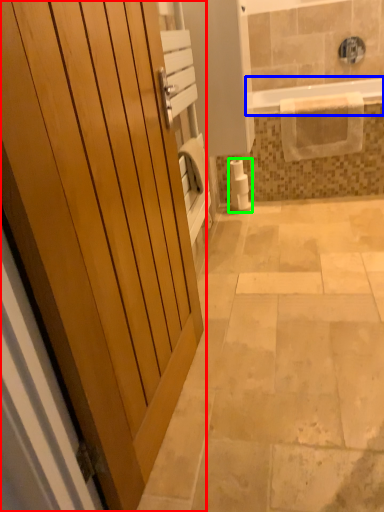
Question: Considering the real-world distances, which object is closest to door (highlighted by a red box)? bathtub (highlighted by a blue box) or toilet paper (highlighted by a green box).

Choices:
 (A) bathtub
 (B) toilet paper

Answer: (B)